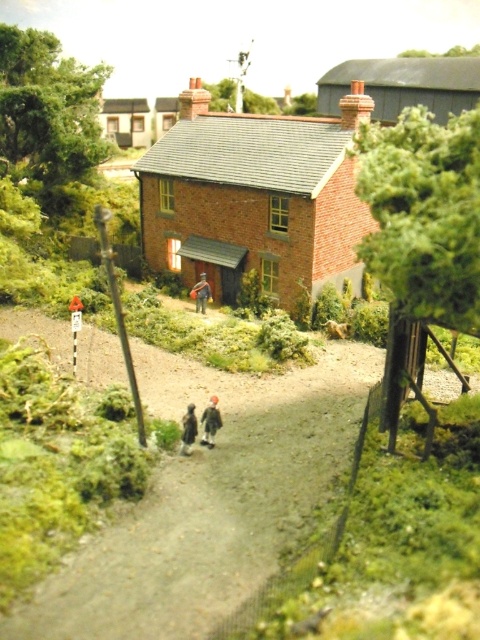
You are a tailor who needs to determine which coat requires more fabric to make between the brown woolen coat at center and the dark brown leather jacket at center. Which one would you choose?

The brown woolen coat at center requires more fabric because its width is larger than the dark brown leather jacket at center.

You are standing at the entrance of the two story brick house in the image. You need to place a new decorative flag exactly where the brown woolen coat at center is currently located. Is this location visible from the front door? Please explain.

The brown woolen coat at center is located at coordinates point (211, 420), which is in the central area of the image. Since the flag would be placed at this central position, it would be clearly visible from the front door of the two story brick house.

In the scene shown: You are a delivery person trying to deliver a package to the house in the miniature scene. You notice two figures on the dirt path. Which figure, the brown woolen coat at center or the smooth brown figure at center, is more likely to be the homeowner based on their size?

The smooth brown figure at center is more likely to be the homeowner because the brown woolen coat at center has a smaller size compared to smooth brown figure at center, suggesting the latter is closer in size to an actual person.